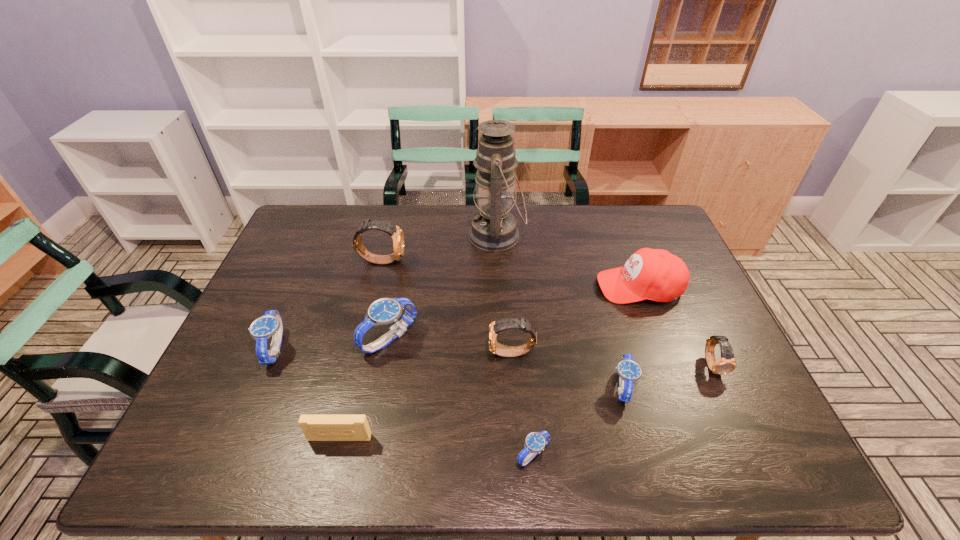
Identify the location of videotape present at the near edge. This screenshot has width=960, height=540. (315, 427).

In order to click on watch positioned at the near edge in this screenshot , I will do `click(535, 441)`.

Locate an element on the screen. object situated at the left edge is located at coordinates (269, 325).

This screenshot has width=960, height=540. I want to click on baseball cap located in the right edge section of the desktop, so click(649, 274).

Where is `watch that is positioned at the right edge`? watch that is positioned at the right edge is located at coordinates (726, 364).

This screenshot has width=960, height=540. I want to click on free space at the far edge of the desktop, so click(524, 218).

The image size is (960, 540). Find the location of `vacant space at the near edge`. vacant space at the near edge is located at coordinates (558, 438).

Locate an element on the screen. Image resolution: width=960 pixels, height=540 pixels. free space at the right edge of the desktop is located at coordinates (725, 421).

Where is `vacant space at the far left corner`? The width and height of the screenshot is (960, 540). vacant space at the far left corner is located at coordinates (333, 241).

In the image, there is a desktop. Where is `free space at the far right corner`? free space at the far right corner is located at coordinates tap(654, 237).